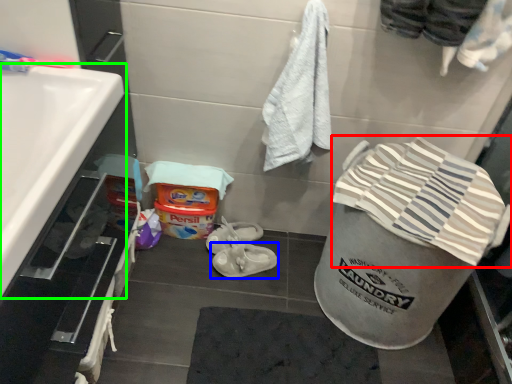
Question: Which object is positioned farthest from beach towel (highlighted by a red box)? Select from footwear (highlighted by a blue box) and sink (highlighted by a green box).

Choices:
 (A) footwear
 (B) sink

Answer: (B)